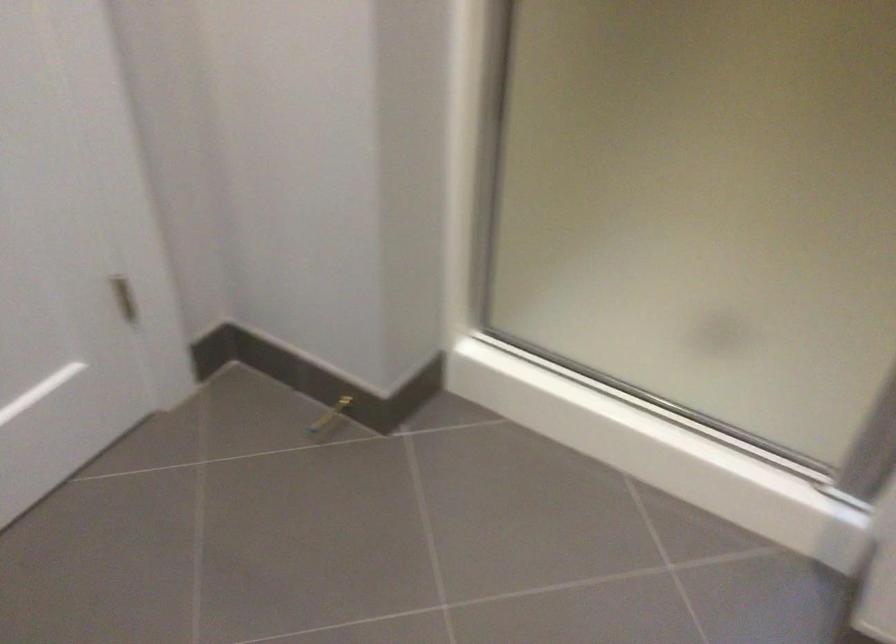
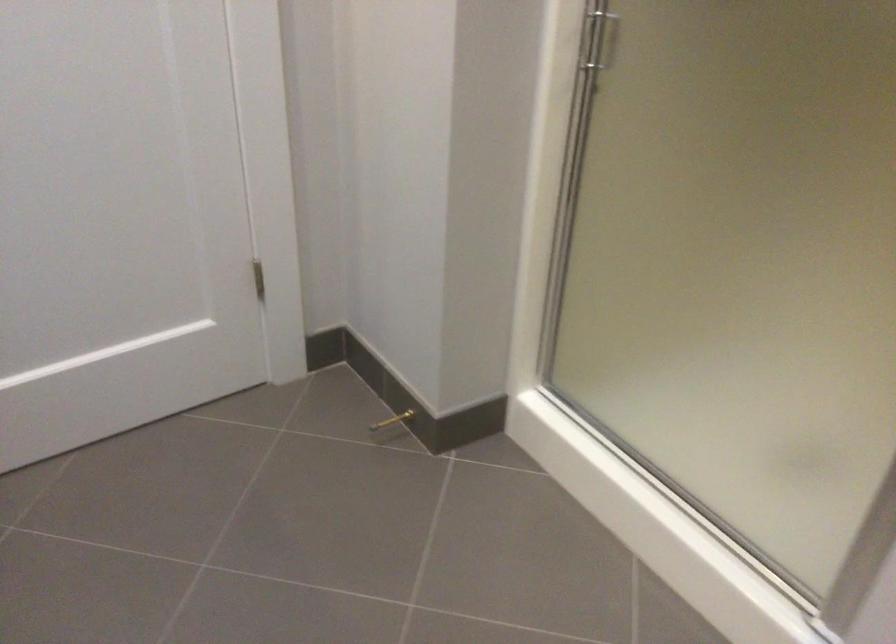
Find the pixel in the second image that matches the point at 322,412 in the first image.

(392, 420)